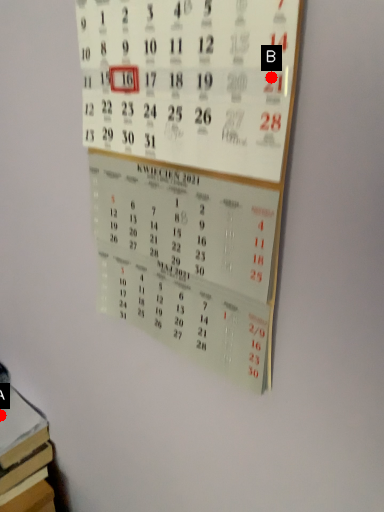
Question: Two points are circled on the image, labeled by A and B beside each circle. Among these points, which one is farthest from the camera?

Choices:
 (A) A is further
 (B) B is further

Answer: (A)